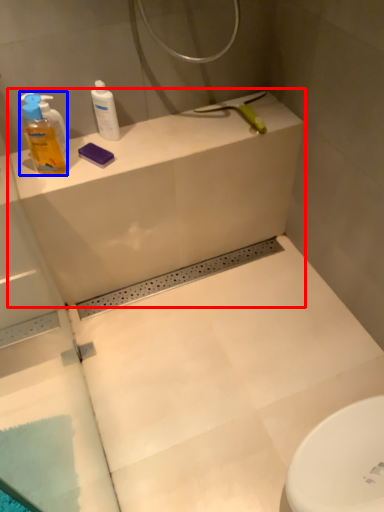
Question: Which point is closer to the camera, counter top (highlighted by a red box) or cleaning product (highlighted by a blue box)?

Choices:
 (A) counter top
 (B) cleaning product

Answer: (B)